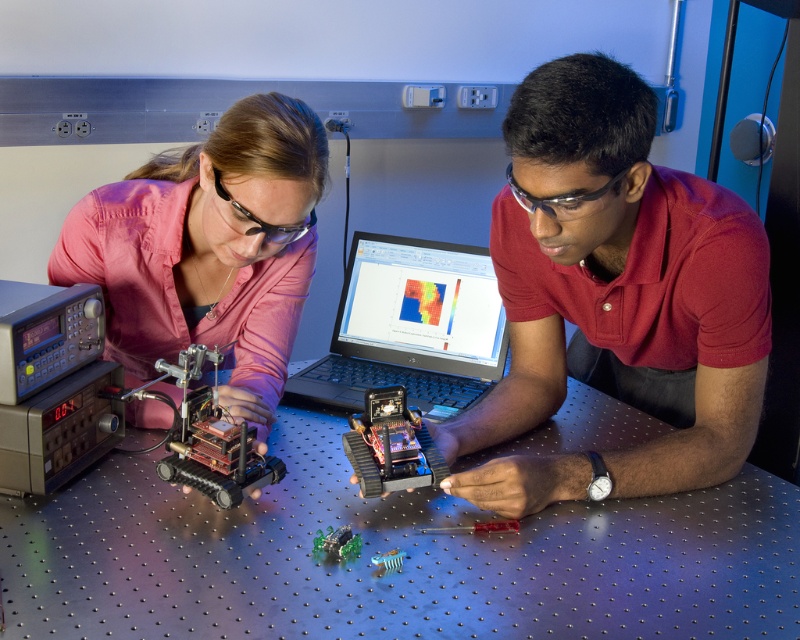
Between silver metallic laptop at center and metallic circuit board at left, which one appears on the left side from the viewer's perspective?

metallic circuit board at left

Who is more forward, (358, 305) or (252, 458)?

Point (252, 458)

Identify the location of silver metallic laptop at center. (412, 326).

Is metallic circuit board at left below shiny metallic circuit board at center?

No.

Consider the image. Is metallic circuit board at left above shiny metallic circuit board at center?

Correct, metallic circuit board at left is located above shiny metallic circuit board at center.

Between point (254, 464) and point (368, 470), which one is positioned behind?

Point (254, 464)

This screenshot has height=640, width=800. What are the coordinates of `metallic circuit board at left` in the screenshot? It's located at (208, 435).

Which of these two, silver metallic laptop at center or gray metallic electronic device at left, stands taller?

silver metallic laptop at center is taller.

Is silver metallic laptop at center to the left of gray metallic electronic device at left from the viewer's perspective?

No, silver metallic laptop at center is not to the left of gray metallic electronic device at left.

Measure the distance between point (454, 365) and camera.

Point (454, 365) and camera are 1.51 meters apart from each other.

Locate an element on the screen. The width and height of the screenshot is (800, 640). silver metallic laptop at center is located at coordinates (412, 326).